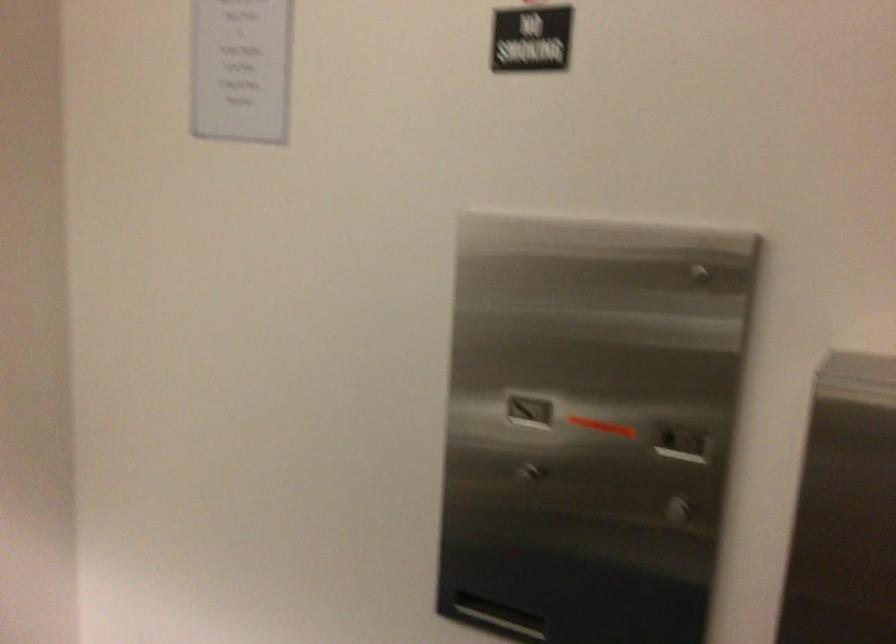
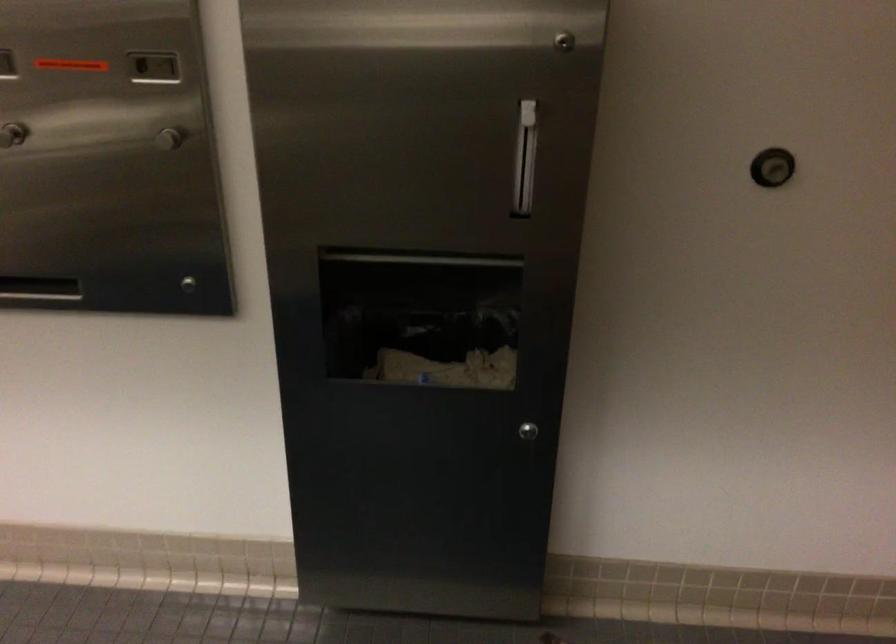
First-person continuous shooting, in which direction is the camera rotating?

The rotation direction of the camera is right-down.